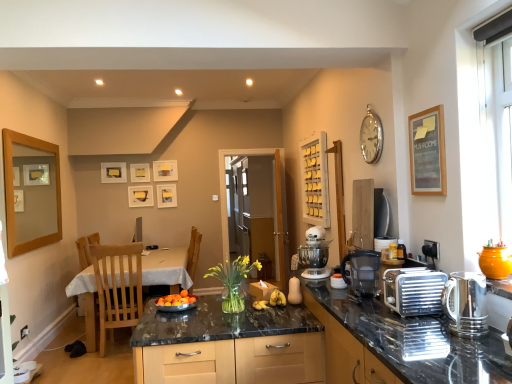
Find the location of `vacant area that is in front of black plastic water filter at center, acting as the 1th kitchen appliance starting from the back`. vacant area that is in front of black plastic water filter at center, acting as the 1th kitchen appliance starting from the back is located at coordinates (359, 301).